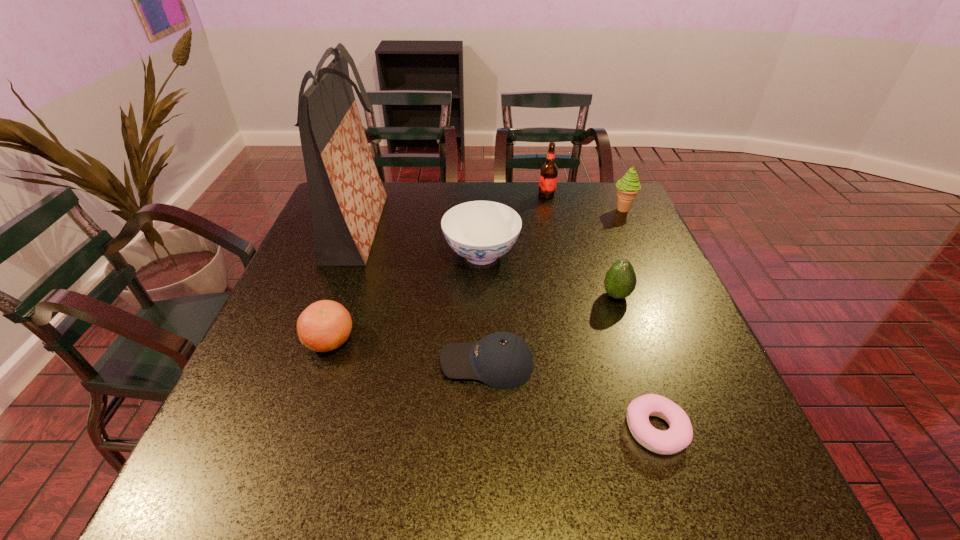
This screenshot has height=540, width=960. Find the location of `shopping bag`. shopping bag is located at coordinates (347, 197).

I want to click on root beer, so click(x=548, y=175).

Locate an element on the screen. the rightmost object is located at coordinates (627, 188).

Identify the location of icecream. (627, 188).

This screenshot has width=960, height=540. I want to click on avocado, so click(620, 281).

The width and height of the screenshot is (960, 540). I want to click on chinaware, so [x=480, y=231].

This screenshot has height=540, width=960. In order to click on the sixth tallest object in this screenshot , I will do `click(325, 325)`.

This screenshot has width=960, height=540. I want to click on baseball cap, so click(x=503, y=360).

Locate an element on the screen. pastry is located at coordinates (679, 435).

The image size is (960, 540). Find the location of `the nearest object`. the nearest object is located at coordinates (679, 435).